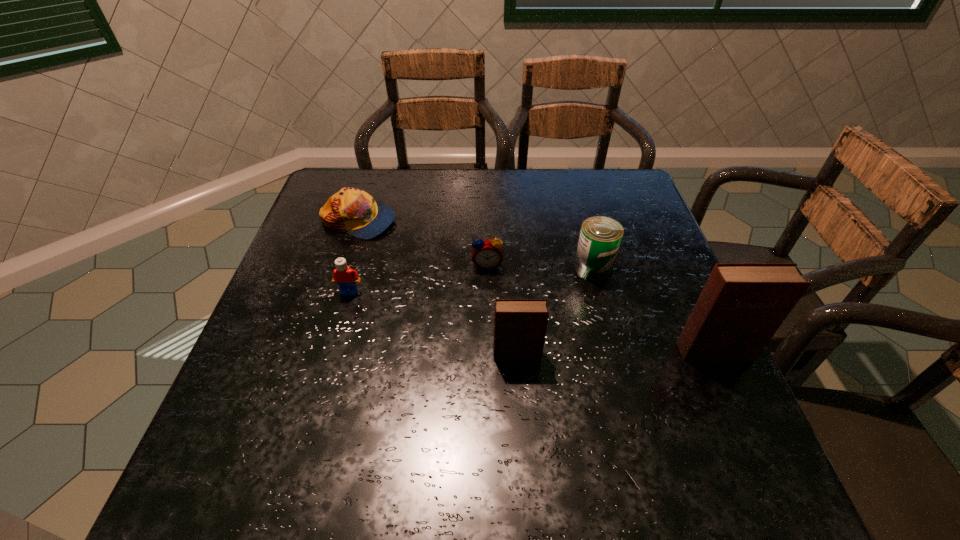
Image resolution: width=960 pixels, height=540 pixels. I want to click on empty location between the fifth shortest object and the Lego, so click(433, 323).

Identify the location of free spot between the tallest object and the alarm clock. (601, 308).

At what (x,y) coordinates should I click in order to perform the action: click on vacant space in between the left diary and the fourth shortest object. Please return your answer as a coordinate pair (x, y). Looking at the image, I should click on [555, 312].

Where is `vacant space in between the farthest object and the alarm clock`? vacant space in between the farthest object and the alarm clock is located at coordinates (422, 243).

Identify which object is the third nearest to the fourth farthest object. Please provide its 2D coordinates. Your answer should be formatted as a tuple, i.e. [(x, y)], where the tuple contains the x and y coordinates of a point satisfying the conditions above.

[(520, 325)]

Where is `object that stands as the closest to the alarm clock`? This screenshot has height=540, width=960. object that stands as the closest to the alarm clock is located at coordinates (600, 237).

Identify the location of vacant position in the image that satisfies the following two spatial constraints: 1. on the bill of the farthest object; 2. on the back side of the fourth shortest object. Image resolution: width=960 pixels, height=540 pixels. (343, 268).

Identify the location of vacant space that satisfies the following two spatial constraints: 1. on the front-facing side of the third tallest object; 2. on the right side of the alarm clock. Image resolution: width=960 pixels, height=540 pixels. (488, 268).

Where is `vacant region that satisfies the following two spatial constraints: 1. on the front-facing side of the second object from right to left; 2. on the right side of the alarm clock`? Image resolution: width=960 pixels, height=540 pixels. vacant region that satisfies the following two spatial constraints: 1. on the front-facing side of the second object from right to left; 2. on the right side of the alarm clock is located at coordinates (488, 268).